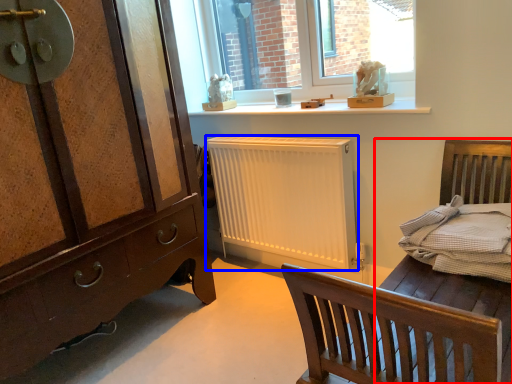
Question: Which object appears closest to the camera in this image, bed frame (highlighted by a red box) or radiator (highlighted by a blue box)?

Choices:
 (A) bed frame
 (B) radiator

Answer: (A)